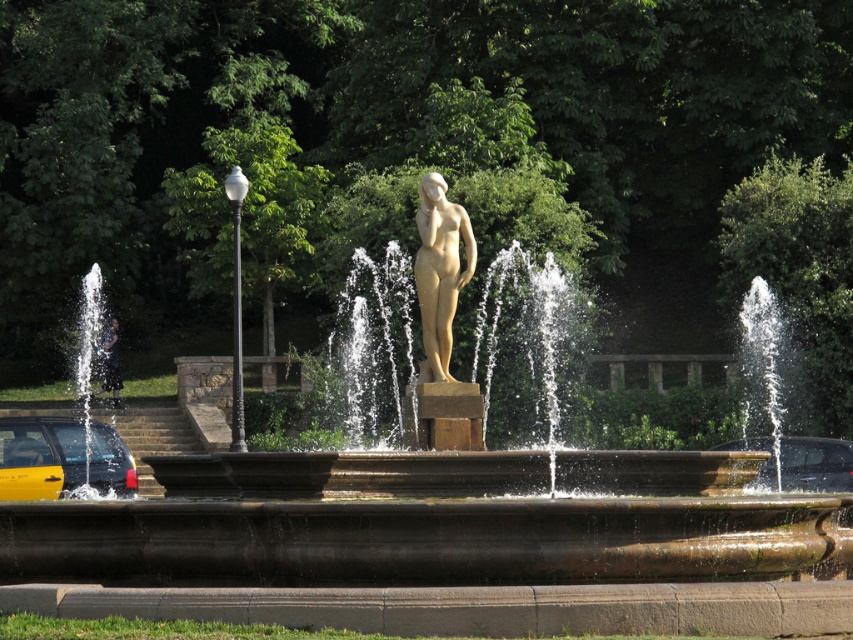
You are standing in front of the fountain and want to take a photo of both the matte gold statue at center and the metallic silver car at lower right. Which object should you focus on first to ensure both are in the frame?

You should focus on the matte gold statue at center first since it is closer to the viewer than the metallic silver car at lower right, allowing both to be in the frame when adjusted properly.